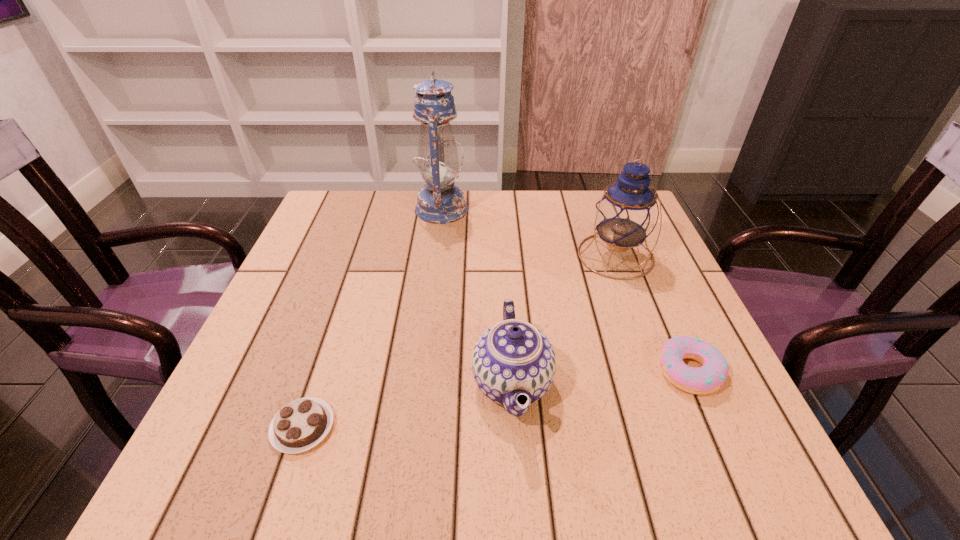
You are a GUI agent. You are given a task and a screenshot of the screen. Output one action in this format:
    pyautogui.click(x=<x>, y=<y>)
    Task: Click on the free location located on the front-facing side of the right lantern
    This screenshot has width=960, height=540.
    Given the screenshot: What is the action you would take?
    pyautogui.click(x=652, y=354)

Identify the location of vacant space located 0.390m at the spout of the third tallest object. (252, 383).

You are a GUI agent. You are given a task and a screenshot of the screen. Output one action in this format:
    pyautogui.click(x=<x>, y=<y>)
    Task: Click on the free space located 0.320m at the spout of the third tallest object
    The image size is (960, 540).
    Given the screenshot: What is the action you would take?
    pyautogui.click(x=292, y=383)

This screenshot has width=960, height=540. Identify the location of free space located at the spout of the third tallest object. (337, 383).

At what (x,y) coordinates should I click in order to perform the action: click on blank area located on the left of the fourth tallest object. Please return your answer as a coordinate pair (x, y). Looking at the image, I should click on (492, 370).

The width and height of the screenshot is (960, 540). What are the coordinates of `free space located on the back of the chocolate cake` in the screenshot? It's located at (359, 258).

Find the location of a particular element. The height and width of the screenshot is (540, 960). chinaware present at the near edge is located at coordinates (511, 358).

Where is `chocolate cake at the near edge`? The image size is (960, 540). chocolate cake at the near edge is located at coordinates (300, 425).

Find the location of a particular element. This screenshot has height=540, width=960. object present at the left edge is located at coordinates (300, 425).

Image resolution: width=960 pixels, height=540 pixels. Identify the location of lantern situated at the right edge. (626, 214).